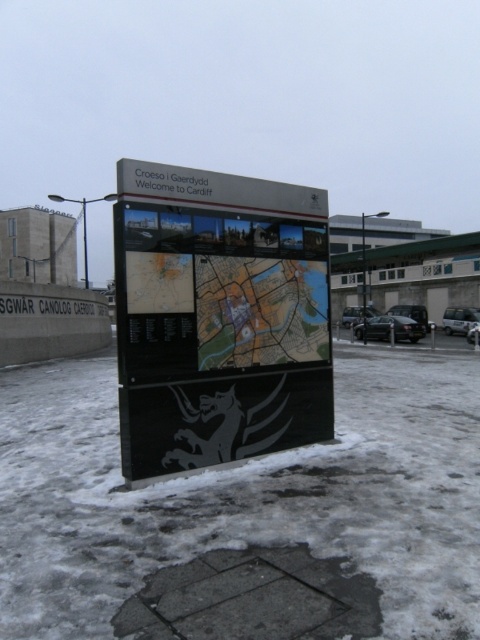
Between white powdery snow at lower center and black asphalt parking lot at lower right, which one appears on the right side from the viewer's perspective?

black asphalt parking lot at lower right

Image resolution: width=480 pixels, height=640 pixels. What do you see at coordinates (249, 509) in the screenshot? I see `white powdery snow at lower center` at bounding box center [249, 509].

Is point (25, 444) closer to viewer compared to point (384, 324)?

Yes, it is in front of point (384, 324).

Image resolution: width=480 pixels, height=640 pixels. What are the coordinates of `white powdery snow at lower center` in the screenshot? It's located at (249, 509).

Can you confirm if white powdery snow at lower center is wider than matte black signboard at center?

Yes, white powdery snow at lower center is wider than matte black signboard at center.

Between white powdery snow at lower center and matte black signboard at center, which one has more height?

Standing taller between the two is white powdery snow at lower center.

Where is `white powdery snow at lower center`? white powdery snow at lower center is located at coordinates (249, 509).

Locate an element on the screen. The width and height of the screenshot is (480, 640). white powdery snow at lower center is located at coordinates (249, 509).

Who is more forward, [192,316] or [408,316]?

Positioned in front is point [192,316].

Which is below, matte black signboard at center or black asphalt parking lot at lower right?

matte black signboard at center is below.

In order to click on matte black signboard at center in this screenshot , I will do `click(218, 317)`.

I want to click on matte black signboard at center, so click(218, 317).